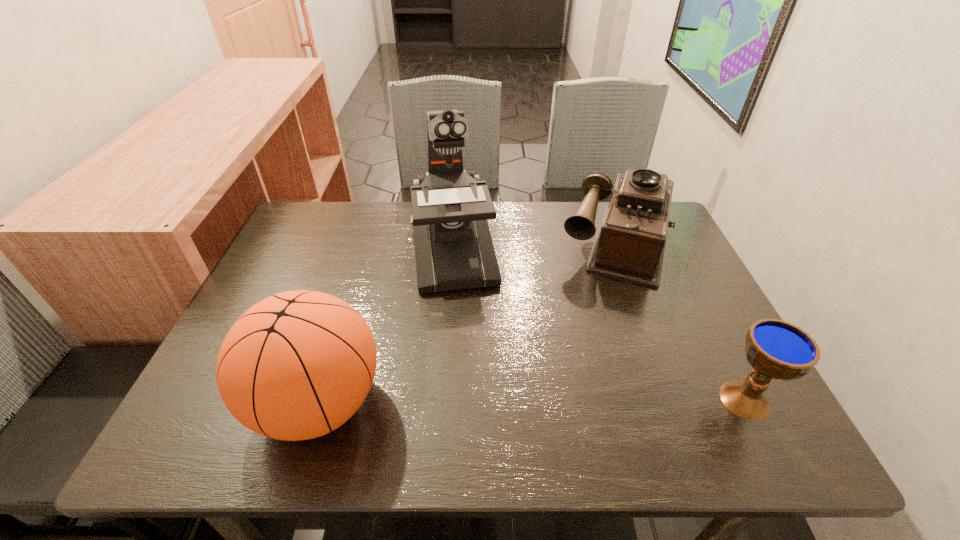
Identify the location of vacant space on the desktop that is between the basketball and the chalice and is positioned on the horn of the phonograph_record. (574, 401).

This screenshot has width=960, height=540. Identify the location of vacant space on the desktop that is between the basketball and the chalice and is positioned through the eyepieces of the microscope. (479, 402).